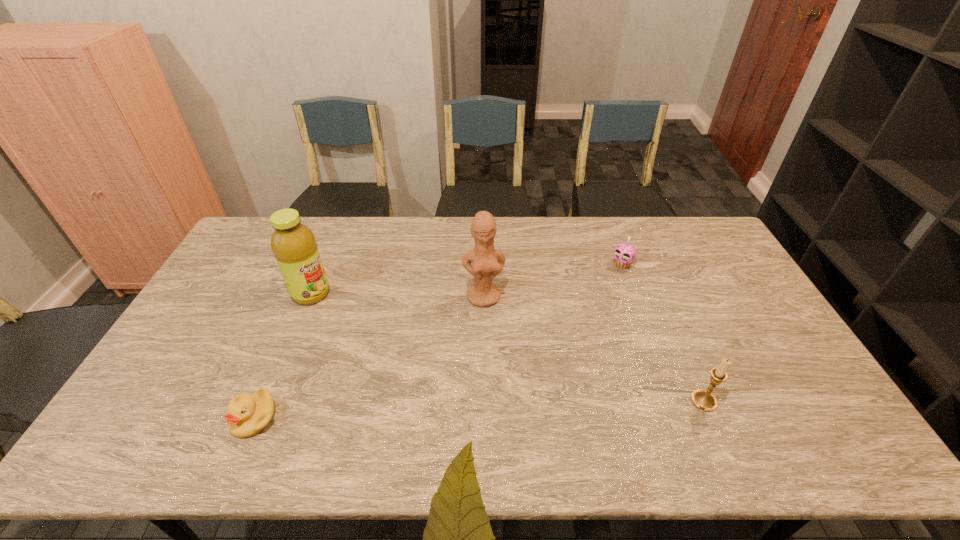
You are a GUI agent. You are given a task and a screenshot of the screen. Output one action in this format:
    pyautogui.click(x=<x>, y=<y>)
    Task: Click on the duckling
    The width and height of the screenshot is (960, 540).
    Given the screenshot: What is the action you would take?
    coord(247,415)

Where is `the third tallest object`? The image size is (960, 540). the third tallest object is located at coordinates (702, 399).

Find the location of a particular element. candle holder is located at coordinates (702, 399).

At what (x,y) coordinates should I click in order to perform the action: click on the third object from right to left. Please return your answer as a coordinate pair (x, y). This screenshot has width=960, height=540. Looking at the image, I should click on (487, 262).

Identify the location of fruit juice. (293, 244).

This screenshot has height=540, width=960. What are the coordinates of `the farthest object` in the screenshot? It's located at (624, 254).

At what (x,y) coordinates should I click in order to perform the action: click on the second shortest object. Please return your answer as a coordinate pair (x, y). The image size is (960, 540). Looking at the image, I should click on (624, 254).

Find the location of a particular element. Image resolution: width=960 pixels, height=540 pixels. vacant space located on the back of the third tallest object is located at coordinates (684, 354).

The height and width of the screenshot is (540, 960). Find the location of `vacant space located 0.160m on the front-facing side of the figurine`. vacant space located 0.160m on the front-facing side of the figurine is located at coordinates (493, 349).

You are a GUI agent. You are given a task and a screenshot of the screen. Output one action in this format:
    pyautogui.click(x=<x>, y=<y>)
    Task: Click on the free space located on the front-facing side of the figurine
    
    Given the screenshot: What is the action you would take?
    pyautogui.click(x=504, y=412)